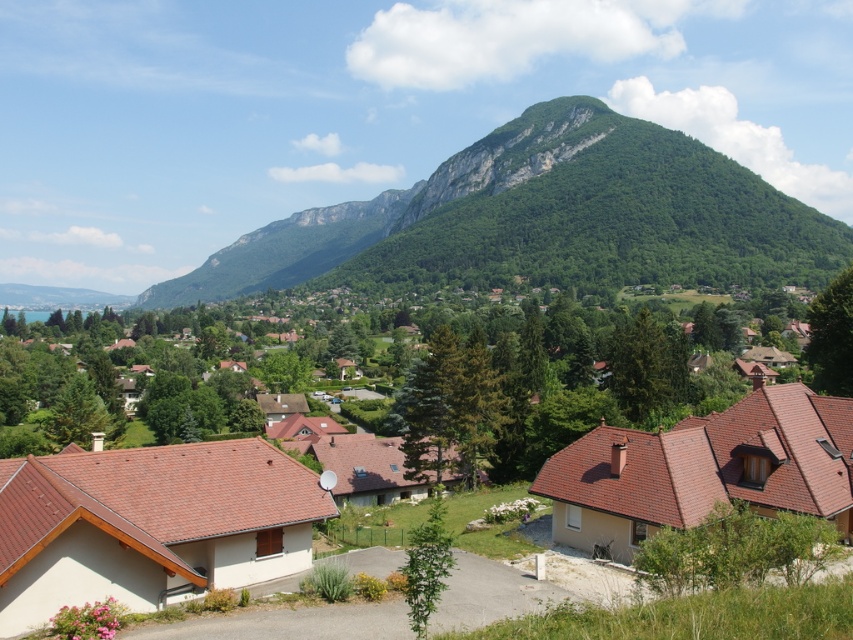
Question: Is green forested mountain at upper center further to camera compared to brown tiled houses at center?

Choices:
 (A) yes
 (B) no

Answer: (A)

Question: Is green forested mountain at upper center below brown tiled houses at center?

Choices:
 (A) no
 (B) yes

Answer: (A)

Question: Which point is closer to the camera?

Choices:
 (A) (560, 154)
 (B) (32, 547)

Answer: (B)

Question: Is green forested mountain at upper center bigger than brown tiled houses at center?

Choices:
 (A) no
 (B) yes

Answer: (B)

Question: Which point is farther from the camera taking this photo?

Choices:
 (A) (624, 262)
 (B) (595, 474)

Answer: (A)

Question: Among these points, which one is nearest to the camera?

Choices:
 (A) (619, 236)
 (B) (811, 413)

Answer: (B)